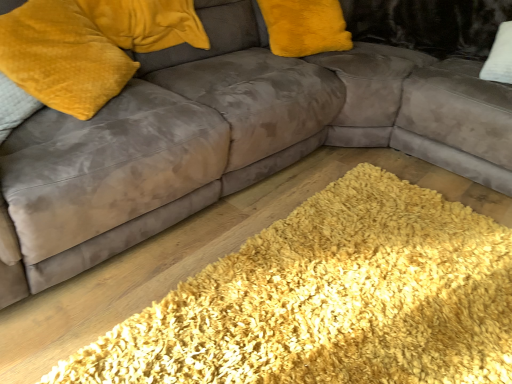
Question: Is shaggy yellow rug at lower center positioned before velvet yellow pillow at upper left?

Choices:
 (A) no
 (B) yes

Answer: (B)

Question: Is shaggy yellow rug at lower center to the left of velvet yellow pillow at upper left from the viewer's perspective?

Choices:
 (A) no
 (B) yes

Answer: (A)

Question: Does shaggy yellow rug at lower center touch velvet yellow pillow at upper left?

Choices:
 (A) no
 (B) yes

Answer: (A)

Question: Does shaggy yellow rug at lower center have a larger size compared to velvet yellow pillow at upper left?

Choices:
 (A) yes
 (B) no

Answer: (A)

Question: Is shaggy yellow rug at lower center outside velvet yellow pillow at upper left?

Choices:
 (A) yes
 (B) no

Answer: (A)

Question: Would you say velvet yellow pillow at upper left is part of shaggy yellow rug at lower center's contents?

Choices:
 (A) yes
 (B) no

Answer: (B)

Question: From the image's perspective, does velvet yellow pillow at upper left appear higher than shaggy yellow rug at lower center?

Choices:
 (A) yes
 (B) no

Answer: (A)

Question: Does velvet yellow pillow at upper left appear on the left side of shaggy yellow rug at lower center?

Choices:
 (A) yes
 (B) no

Answer: (A)

Question: Can you confirm if velvet yellow pillow at upper left is taller than shaggy yellow rug at lower center?

Choices:
 (A) no
 (B) yes

Answer: (B)

Question: Is velvet yellow pillow at upper left shorter than shaggy yellow rug at lower center?

Choices:
 (A) no
 (B) yes

Answer: (A)

Question: Is velvet yellow pillow at upper left positioned beyond the bounds of shaggy yellow rug at lower center?

Choices:
 (A) no
 (B) yes

Answer: (B)

Question: Does velvet yellow pillow at upper left have a greater width compared to shaggy yellow rug at lower center?

Choices:
 (A) yes
 (B) no

Answer: (B)

Question: Is velvet yellow pillow at upper left in front of or behind shaggy yellow rug at lower center in the image?

Choices:
 (A) behind
 (B) front

Answer: (A)